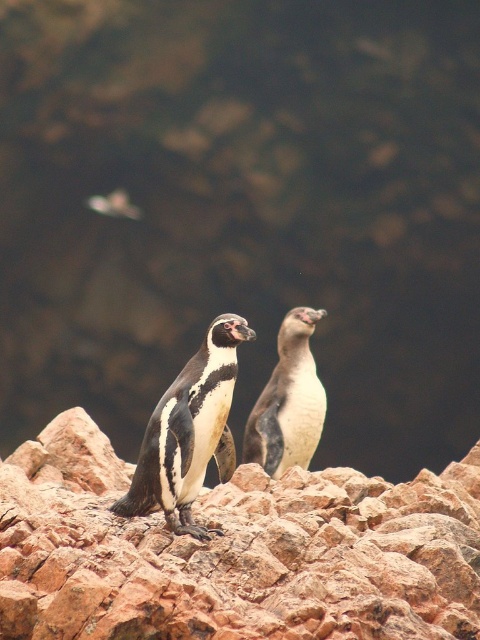
Question: Does rusty stone rocks at center lie behind black glossy penguin at center?

Choices:
 (A) no
 (B) yes

Answer: (A)

Question: Does rusty stone rocks at center appear over white matte penguin at center?

Choices:
 (A) no
 (B) yes

Answer: (A)

Question: Which point appears farthest from the camera in this image?

Choices:
 (A) (468, 616)
 (B) (272, 412)
 (C) (120, 499)

Answer: (B)

Question: Which point is farther to the camera?

Choices:
 (A) white matte penguin at center
 (B) rusty stone rocks at center

Answer: (A)

Question: Is black glossy penguin at center closer to the viewer compared to white matte penguin at center?

Choices:
 (A) yes
 (B) no

Answer: (A)

Question: Among these objects, which one is farthest from the camera?

Choices:
 (A) black glossy penguin at center
 (B) white matte penguin at center
 (C) rusty stone rocks at center

Answer: (B)